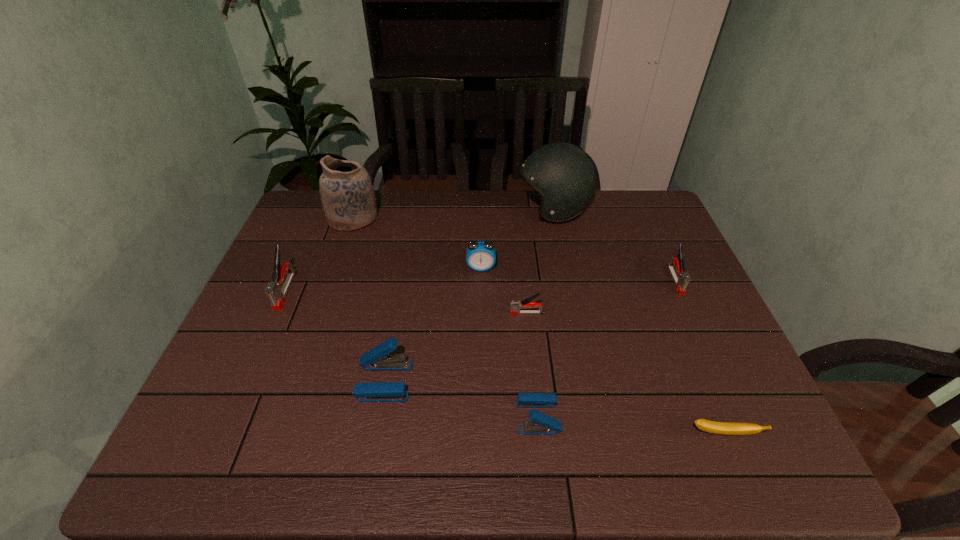
Locate an element on the screen. The image size is (960, 540). unoccupied area between the fourth stapler from right to left and the rightmost stapler is located at coordinates (530, 330).

Find the location of a particular element. vacant space in between the right blue stapler and the rightmost stapler is located at coordinates (607, 348).

Identify the location of empty space that is in between the alarm clock and the football helmet. (516, 238).

Identify the location of free spot between the leftmost object and the second gray stapler from left to right. (406, 302).

Locate which object ranks second in proximity to the football helmet. Please provide its 2D coordinates. Your answer should be formatted as a tuple, i.e. [(x, y)], where the tuple contains the x and y coordinates of a point satisfying the conditions above.

[(681, 278)]

At what (x,y) coordinates should I click in order to perform the action: click on object that is the sixth closest to the banana. Please return your answer as a coordinate pair (x, y). This screenshot has height=540, width=960. Looking at the image, I should click on (563, 175).

Locate which stapler ranks in proximity to the alarm clock. Please provide its 2D coordinates. Your answer should be formatted as a tuple, i.e. [(x, y)], where the tuple contains the x and y coordinates of a point satisfying the conditions above.

[(516, 305)]

Locate which stapler is the second closest to the pottery. Please provide its 2D coordinates. Your answer should be formatted as a tuple, i.e. [(x, y)], where the tuple contains the x and y coordinates of a point satisfying the conditions above.

[(377, 359)]

Locate an element on the screen. This screenshot has height=540, width=960. gray stapler that is the third closest to the third object from left to right is located at coordinates (681, 278).

Identify which gray stapler is the nearest to the smallest gray stapler. Please provide its 2D coordinates. Your answer should be formatted as a tuple, i.e. [(x, y)], where the tuple contains the x and y coordinates of a point satisfying the conditions above.

[(681, 278)]